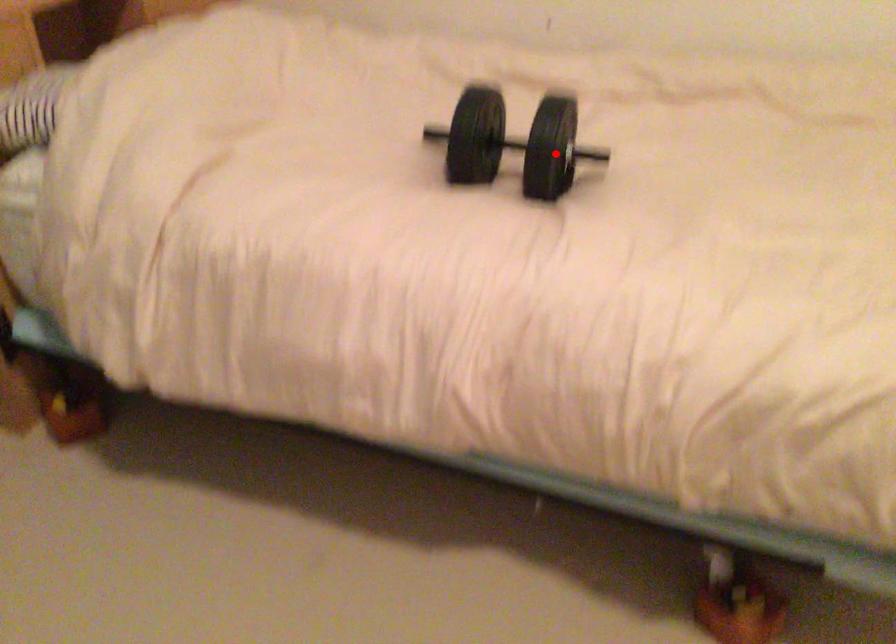
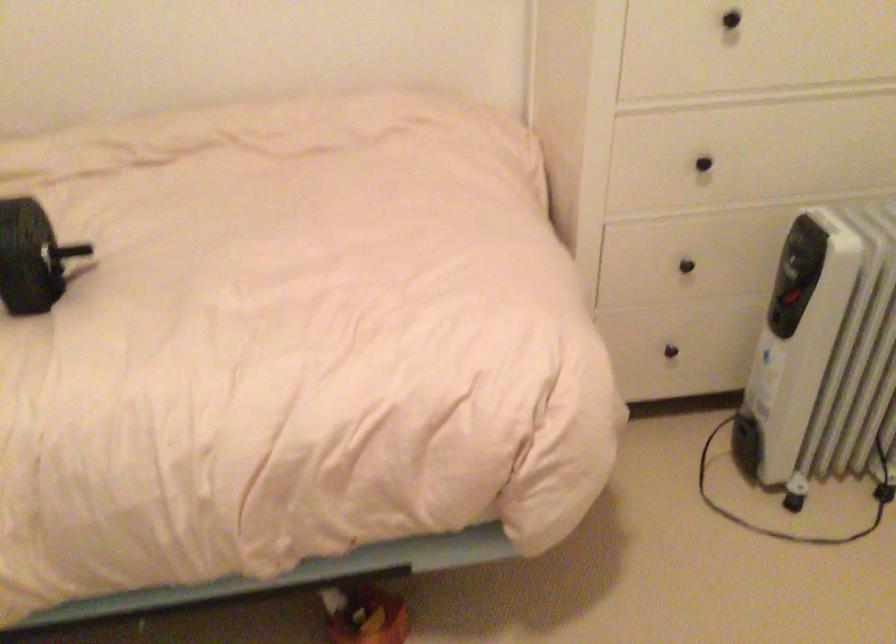
Locate, in the second image, the point that corresponds to the highlighted location in the first image.

(30, 257)